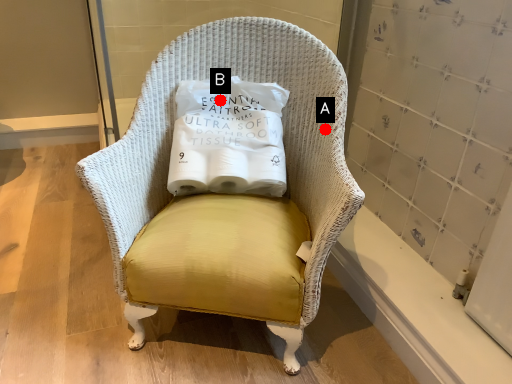
Question: Two points are circled on the image, labeled by A and B beside each circle. Which of the following is the farthest from the observer?

Choices:
 (A) A is further
 (B) B is further

Answer: (B)